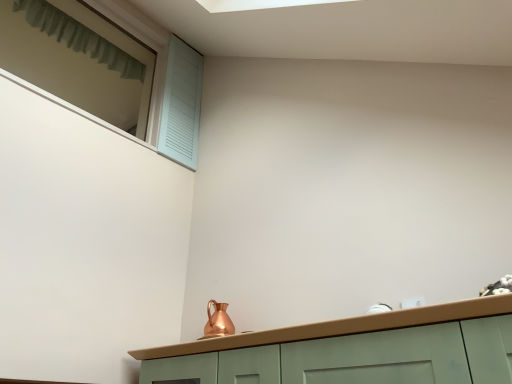
Image resolution: width=512 pixels, height=384 pixels. I want to click on copper metallic pitcher at center, so (x=218, y=321).

Find the location of a particular element. The height and width of the screenshot is (384, 512). light blue wooden shutter at upper left is located at coordinates (106, 72).

Based on their positions, is green fabric curtain at upper left located to the left or right of light blue wooden shutter at upper left?

green fabric curtain at upper left is positioned on light blue wooden shutter at upper left's left side.

From a real-world perspective, is green fabric curtain at upper left on light blue wooden shutter at upper left?

Correct, in the physical world, green fabric curtain at upper left is higher than light blue wooden shutter at upper left.

In terms of width, does green fabric curtain at upper left look wider or thinner when compared to light blue wooden shutter at upper left?

Considering their sizes, green fabric curtain at upper left looks slimmer than light blue wooden shutter at upper left.

From the picture: Is green fabric curtain at upper left turned away from light blue wooden shutter at upper left?

green fabric curtain at upper left is not turned away from light blue wooden shutter at upper left.

Considering the sizes of light blue wooden shutter at upper left and green fabric curtain at upper left in the image, is light blue wooden shutter at upper left taller or shorter than green fabric curtain at upper left?

In the image, light blue wooden shutter at upper left appears to be taller than green fabric curtain at upper left.

Between light blue wooden shutter at upper left and green fabric curtain at upper left, which one appears on the right side from the viewer's perspective?

light blue wooden shutter at upper left.

Are light blue wooden shutter at upper left and green fabric curtain at upper left far apart?

Actually, light blue wooden shutter at upper left and green fabric curtain at upper left are a little close together.

Find the location of a particular element. Image resolution: width=512 pixels, height=384 pixels. window in front of the green fabric curtain at upper left is located at coordinates (106, 72).

Considering the positions of objects copper metallic pitcher at center and green fabric curtain at upper left in the image provided, who is more to the left, copper metallic pitcher at center or green fabric curtain at upper left?

green fabric curtain at upper left is more to the left.

Considering the sizes of copper metallic pitcher at center and green fabric curtain at upper left in the image, is copper metallic pitcher at center wider or thinner than green fabric curtain at upper left?

In the image, copper metallic pitcher at center appears to be more narrow than green fabric curtain at upper left.

Would you say copper metallic pitcher at center is inside or outside green fabric curtain at upper left?

→ copper metallic pitcher at center exists outside the volume of green fabric curtain at upper left.

Is light blue wooden shutter at upper left bigger or smaller than copper metallic pitcher at center?

light blue wooden shutter at upper left is bigger than copper metallic pitcher at center.

Which object is positioned more to the left, light blue wooden shutter at upper left or copper metallic pitcher at center?

light blue wooden shutter at upper left is more to the left.

Is light blue wooden shutter at upper left next to copper metallic pitcher at center and touching it?

No.

Would you consider copper metallic pitcher at center to be distant from light blue wooden shutter at upper left?

Absolutely, copper metallic pitcher at center is distant from light blue wooden shutter at upper left.

Considering the relative sizes of copper metallic pitcher at center and light blue wooden shutter at upper left in the image provided, is copper metallic pitcher at center taller than light blue wooden shutter at upper left?

Incorrect, the height of copper metallic pitcher at center is not larger of that of light blue wooden shutter at upper left.

Considering the relative positions of copper metallic pitcher at center and light blue wooden shutter at upper left in the image provided, is copper metallic pitcher at center behind light blue wooden shutter at upper left?

No, copper metallic pitcher at center is in front of light blue wooden shutter at upper left.

Looking at this image, how much distance is there between copper metallic pitcher at center and light blue wooden shutter at upper left?

copper metallic pitcher at center is 1.86 meters from light blue wooden shutter at upper left.

Could you tell me if green fabric curtain at upper left is facing copper metallic pitcher at center?

No, green fabric curtain at upper left is not turned towards copper metallic pitcher at center.

Is green fabric curtain at upper left far away from copper metallic pitcher at center?

Yes, green fabric curtain at upper left and copper metallic pitcher at center are quite far apart.

Does point (42, 26) come behind point (211, 323)?

Yes, it is behind point (211, 323).

Is green fabric curtain at upper left positioned behind copper metallic pitcher at center?

Yes, it is.

Identify the location of curtain above the light blue wooden shutter at upper left (from a real-world perspective). (79, 37).

Locate an element on the screen. This screenshot has height=384, width=512. window that appears in front of the green fabric curtain at upper left is located at coordinates (106, 72).

Considering their positions, is green fabric curtain at upper left positioned further to copper metallic pitcher at center than light blue wooden shutter at upper left?

green fabric curtain at upper left lies further to copper metallic pitcher at center than the other object.

Estimate the real-world distances between objects in this image. Which object is further from copper metallic pitcher at center, light blue wooden shutter at upper left or green fabric curtain at upper left?

green fabric curtain at upper left.

Estimate the real-world distances between objects in this image. Which object is closer to green fabric curtain at upper left, light blue wooden shutter at upper left or copper metallic pitcher at center?

light blue wooden shutter at upper left.

Estimate the real-world distances between objects in this image. Which object is closer to green fabric curtain at upper left, copper metallic pitcher at center or light blue wooden shutter at upper left?

light blue wooden shutter at upper left is positioned closer to the anchor green fabric curtain at upper left.

From the image, which object appears to be nearer to light blue wooden shutter at upper left, copper metallic pitcher at center or green fabric curtain at upper left?

Among the two, green fabric curtain at upper left is located nearer to light blue wooden shutter at upper left.

Considering their positions, is green fabric curtain at upper left positioned further to light blue wooden shutter at upper left than copper metallic pitcher at center?

copper metallic pitcher at center is further to light blue wooden shutter at upper left.

Where is `window between green fabric curtain at upper left and copper metallic pitcher at center from top to bottom`? window between green fabric curtain at upper left and copper metallic pitcher at center from top to bottom is located at coordinates (106, 72).